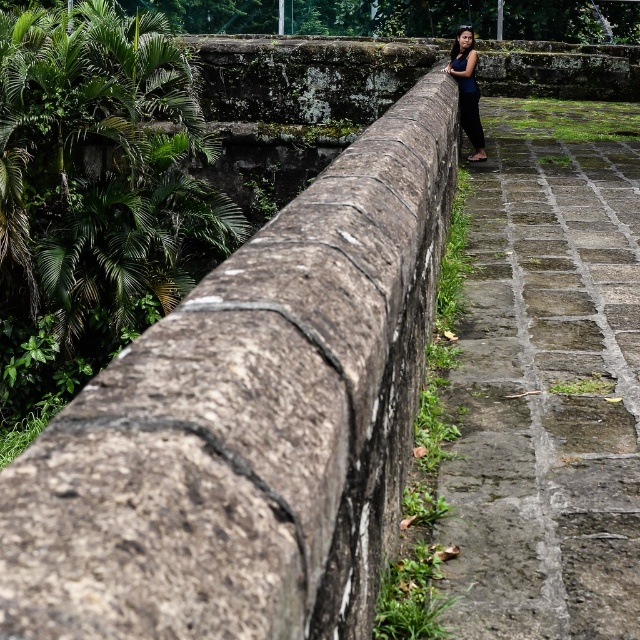
How much distance is there between green mossy stone at right and green leafy foliage at left?

7.14 meters

Which is behind, point (580, 211) or point (6, 86)?

The point (6, 86) is behind.

What do you see at coordinates (547, 384) in the screenshot?
I see `green mossy stone at right` at bounding box center [547, 384].

Locate an element on the screen. green mossy stone at right is located at coordinates (547, 384).

Can you confirm if rusty stone ledge at upper center is smaller than green mossy stone at right?

Correct, rusty stone ledge at upper center occupies less space than green mossy stone at right.

Does rusty stone ledge at upper center have a larger size compared to green mossy stone at right?

No, rusty stone ledge at upper center is not bigger than green mossy stone at right.

Is point (404, 392) behind point (451, 538)?

Yes, it is behind point (451, 538).

Locate an element on the screen. This screenshot has width=640, height=640. rusty stone ledge at upper center is located at coordinates tap(250, 420).

Does rusty stone ledge at upper center appear on the right side of green leafy foliage at left?

Indeed, rusty stone ledge at upper center is positioned on the right side of green leafy foliage at left.

Is point (330, 253) positioned behind point (88, 209)?

No.

Locate an element on the screen. The height and width of the screenshot is (640, 640). rusty stone ledge at upper center is located at coordinates (250, 420).